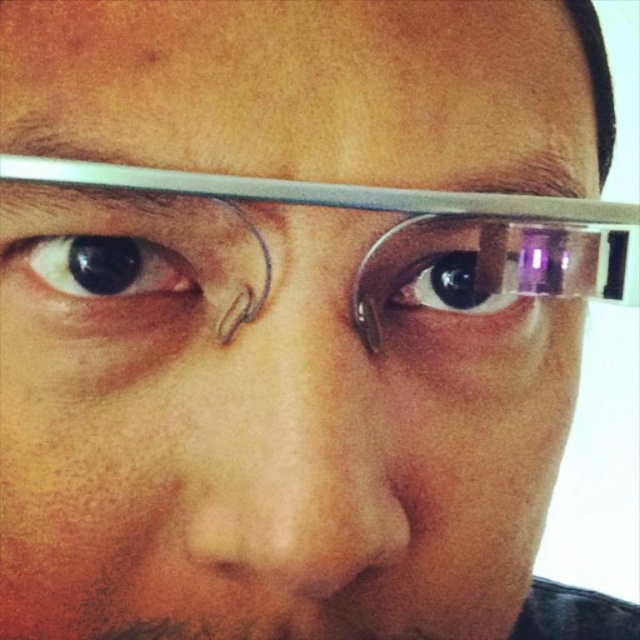
Question: Is clear plastic glasses at upper center above clear glass eye at center?

Choices:
 (A) no
 (B) yes

Answer: (B)

Question: Based on their relative distances, which object is farther from the clear plastic glasses at upper center?

Choices:
 (A) clear glass eye at center
 (B) black glossy eye at left
 (C) smooth skin nose at center

Answer: (B)

Question: Which is nearer to the black glossy eye at left?

Choices:
 (A) smooth skin nose at center
 (B) clear glass eye at center
 (C) clear plastic glasses at upper center

Answer: (A)

Question: Among these objects, which one is nearest to the camera?

Choices:
 (A) smooth skin nose at center
 (B) black glossy eye at left
 (C) clear plastic glasses at upper center
 (D) clear glass eye at center

Answer: (A)

Question: Is smooth skin nose at center positioned before clear plastic glasses at upper center?

Choices:
 (A) yes
 (B) no

Answer: (A)

Question: Can you confirm if smooth skin nose at center is bigger than clear plastic glasses at upper center?

Choices:
 (A) yes
 (B) no

Answer: (B)